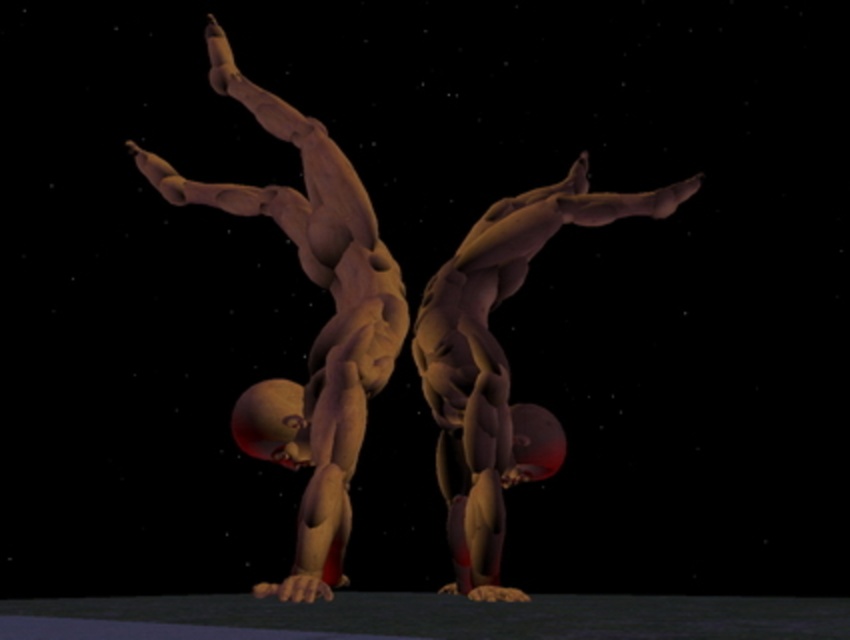
Looking at this image, is matte brown gymnast at left shorter than matte brown gymnast at center?

In fact, matte brown gymnast at left may be taller than matte brown gymnast at center.

Between matte brown gymnast at left and matte brown gymnast at center, which one appears on the right side from the viewer's perspective?

matte brown gymnast at center is more to the right.

Where is `matte brown gymnast at left`? The width and height of the screenshot is (850, 640). matte brown gymnast at left is located at coordinates (319, 330).

The width and height of the screenshot is (850, 640). Identify the location of matte brown gymnast at left. tap(319, 330).